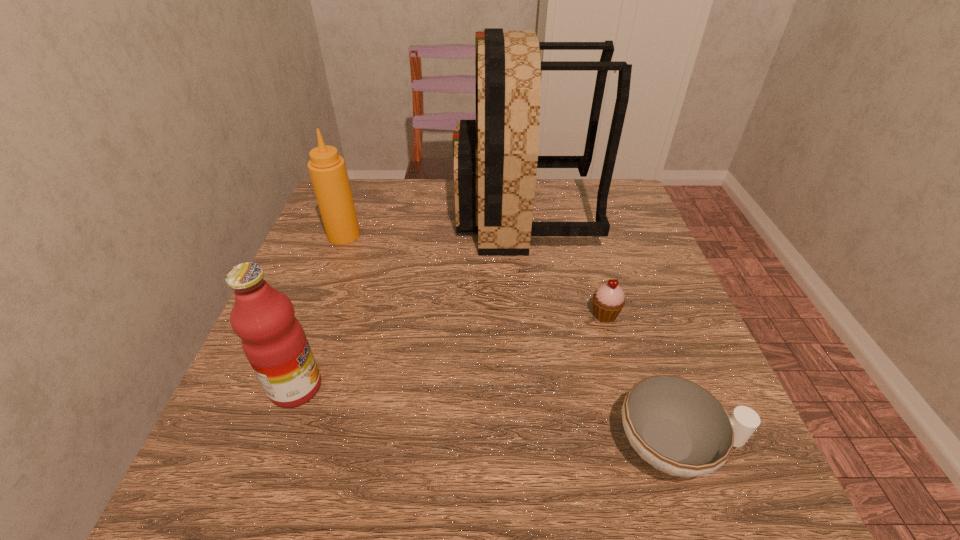
In order to click on object that is positioned at the far right corner in this screenshot , I will do `click(495, 158)`.

Find the location of `object located at the near right corner`. object located at the near right corner is located at coordinates (677, 426).

You are a GUI agent. You are given a task and a screenshot of the screen. Output one action in this format:
    pyautogui.click(x=<x>, y=<y>)
    Task: Click on the free space at the far edge of the desktop
    The height and width of the screenshot is (540, 960).
    Given the screenshot: What is the action you would take?
    pyautogui.click(x=416, y=205)

Where is `vacant space at the near edge`? The width and height of the screenshot is (960, 540). vacant space at the near edge is located at coordinates (432, 471).

Identify the location of free space at the left edge. (294, 269).

I want to click on free space at the right edge, so click(636, 335).

I want to click on empty space that is in between the chinaware and the condiment, so click(510, 340).

Where is `free spot between the third farthest object and the fruit juice`? The image size is (960, 540). free spot between the third farthest object and the fruit juice is located at coordinates (450, 351).

Identify the location of free space that is in between the backpack and the third farthest object. The image size is (960, 540). (564, 264).

Locate an element on the screen. free point between the chinaware and the tallest object is located at coordinates (600, 329).